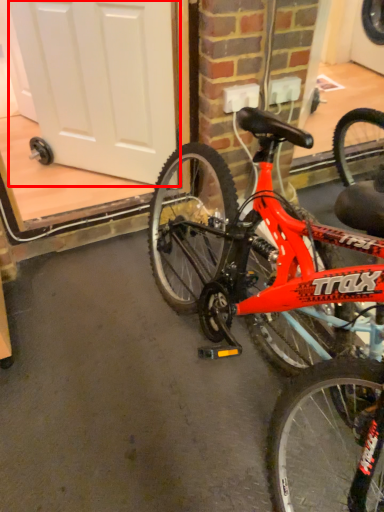
Question: In this image, where is screen door (annotated by the red box) located relative to bicycle?

Choices:
 (A) left
 (B) right

Answer: (A)